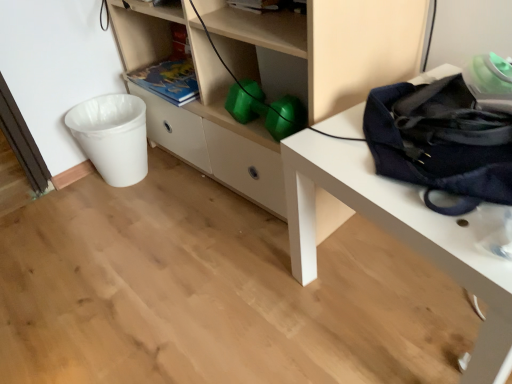
You are a GUI agent. You are given a task and a screenshot of the screen. Output one action in this format:
    pyautogui.click(x=<x>, y=<y>)
    Task: Click on the navy blue fabric bag at right
    
    Given the screenshot: What is the action you would take?
    pyautogui.click(x=396, y=234)

What do you see at coordinates (396, 234) in the screenshot?
I see `navy blue fabric bag at right` at bounding box center [396, 234].

Describe the element at coordinates (441, 142) in the screenshot. The width and height of the screenshot is (512, 384). I see `navy blue fabric messenger bag at right` at that location.

Measure the distance between point (84, 129) and camera.

Point (84, 129) and camera are 4.85 feet apart from each other.

The width and height of the screenshot is (512, 384). In order to click on matte green book at center in this screenshot , I will do `click(168, 80)`.

Does navy blue fabric bag at right come behind matte white shelf at center?

That is False.

Is navy blue fabric bag at right aimed at matte white shelf at center?

No.

Based on their sizes in the image, would you say navy blue fabric bag at right is bigger or smaller than matte white shelf at center?

Considering their sizes, navy blue fabric bag at right takes up less space than matte white shelf at center.

How many degrees apart are the facing directions of navy blue fabric bag at right and matte white shelf at center?

There is a 9.98-degree angle between the facing directions of navy blue fabric bag at right and matte white shelf at center.

From the picture: Is matte white shelf at center positioned far away from navy blue fabric bag at right?

No.

Where is `desk below the matte white shelf at center (from a real-world perspective)`? desk below the matte white shelf at center (from a real-world perspective) is located at coordinates (396, 234).

Between matte white shelf at center and navy blue fabric bag at right, which one appears on the left side from the viewer's perspective?

Positioned to the left is matte white shelf at center.

Is matte white shelf at center looking in the opposite direction of navy blue fabric bag at right?

matte white shelf at center is not turned away from navy blue fabric bag at right.

Is navy blue fabric messenger bag at right to the left or to the right of matte green book at center in the image?

Based on their positions, navy blue fabric messenger bag at right is located to the right of matte green book at center.

Considering the positions of objects navy blue fabric messenger bag at right and matte green book at center in the image provided, who is behind, navy blue fabric messenger bag at right or matte green book at center?

matte green book at center is further away from the camera.

In terms of size, does navy blue fabric messenger bag at right appear bigger or smaller than matte green book at center?

navy blue fabric messenger bag at right is bigger than matte green book at center.

Measure the distance between navy blue fabric messenger bag at right and matte green book at center.

They are 78.36 centimeters apart.

Based on the photo, from the image's perspective, relative to white plastic trash can at left, is navy blue fabric bag at right above or below?

Clearly, from the image's perspective, navy blue fabric bag at right is below white plastic trash can at left.

Locate an element on the screen. waste container above the navy blue fabric bag at right (from the image's perspective) is located at coordinates (112, 136).

Looking at their sizes, would you say navy blue fabric bag at right is wider or thinner than white plastic trash can at left?

navy blue fabric bag at right is wider than white plastic trash can at left.

Can you see white plastic trash can at left touching navy blue fabric bag at right?

white plastic trash can at left and navy blue fabric bag at right are clearly separated.

Looking at this image, which is correct: white plastic trash can at left is inside navy blue fabric bag at right, or outside of it?

white plastic trash can at left exists outside the volume of navy blue fabric bag at right.

Measure the distance between white plastic trash can at left and navy blue fabric bag at right.

The distance of white plastic trash can at left from navy blue fabric bag at right is 34.59 inches.

Is white plastic trash can at left bigger or smaller than navy blue fabric bag at right?

In the image, white plastic trash can at left appears to be smaller than navy blue fabric bag at right.

From the image's perspective, is matte white shelf at center on white plastic trash can at left?

Yes, from the image's perspective, matte white shelf at center is above white plastic trash can at left.

Can you tell me how much matte white shelf at center and white plastic trash can at left differ in facing direction?

matte white shelf at center and white plastic trash can at left are facing 90 degrees away from each other.

Could you tell me if matte white shelf at center is facing white plastic trash can at left?

Yes.

Would you say matte white shelf at center is outside white plastic trash can at left?

Yes.

Is point (511, 154) closer to viewer compared to point (129, 133)?

Yes, point (511, 154) is in front of point (129, 133).

What's the angular difference between navy blue fabric messenger bag at right and white plastic trash can at left's facing directions?

The angle between the facing direction of navy blue fabric messenger bag at right and the facing direction of white plastic trash can at left is 100 degrees.

From the image's perspective, between navy blue fabric messenger bag at right and white plastic trash can at left, which one is located above?

navy blue fabric messenger bag at right appears higher in the image.

Locate an element on the screen. Image resolution: width=512 pixels, height=384 pixels. desk in front of the matte white shelf at center is located at coordinates (396, 234).

In order to click on shelf lying behind the navy blue fabric bag at right in this screenshot , I will do `click(324, 46)`.

Based on the photo, when comparing their distances from matte green book at center, does navy blue fabric bag at right or navy blue fabric messenger bag at right seem closer?

Based on the image, navy blue fabric bag at right appears to be nearer to matte green book at center.

Estimate the real-world distances between objects in this image. Which object is further from matte white shelf at center, matte green book at center or navy blue fabric bag at right?

Among the two, navy blue fabric bag at right is located further to matte white shelf at center.

Estimate the real-world distances between objects in this image. Which object is further from navy blue fabric messenger bag at right, matte green book at center or matte white shelf at center?

matte green book at center is further to navy blue fabric messenger bag at right.

Estimate the real-world distances between objects in this image. Which object is further from navy blue fabric bag at right, matte green book at center or white plastic trash can at left?

white plastic trash can at left is further to navy blue fabric bag at right.

From the image, which object appears to be farther from matte green book at center, navy blue fabric bag at right or white plastic trash can at left?

Based on the image, navy blue fabric bag at right appears to be further to matte green book at center.

Considering their positions, is matte green book at center positioned closer to navy blue fabric bag at right than navy blue fabric messenger bag at right?

The object closer to navy blue fabric bag at right is navy blue fabric messenger bag at right.

Estimate the real-world distances between objects in this image. Which object is further from white plastic trash can at left, navy blue fabric bag at right or navy blue fabric messenger bag at right?

Based on the image, navy blue fabric messenger bag at right appears to be further to white plastic trash can at left.

Considering their positions, is navy blue fabric bag at right positioned closer to white plastic trash can at left than matte green book at center?

matte green book at center lies closer to white plastic trash can at left than the other object.

This screenshot has width=512, height=384. Find the location of `shelf located between white plastic trash can at left and navy blue fabric bag at right in the left-right direction`. shelf located between white plastic trash can at left and navy blue fabric bag at right in the left-right direction is located at coordinates (324, 46).

The image size is (512, 384). I want to click on shelf between white plastic trash can at left and navy blue fabric messenger bag at right, so click(324, 46).

The image size is (512, 384). What are the coordinates of `desk between white plastic trash can at left and navy blue fabric messenger bag at right in the horizontal direction` in the screenshot? It's located at (396, 234).

Where is `shelf between navy blue fabric bag at right and matte green book at center in the front-back direction`? The width and height of the screenshot is (512, 384). shelf between navy blue fabric bag at right and matte green book at center in the front-back direction is located at coordinates (324, 46).